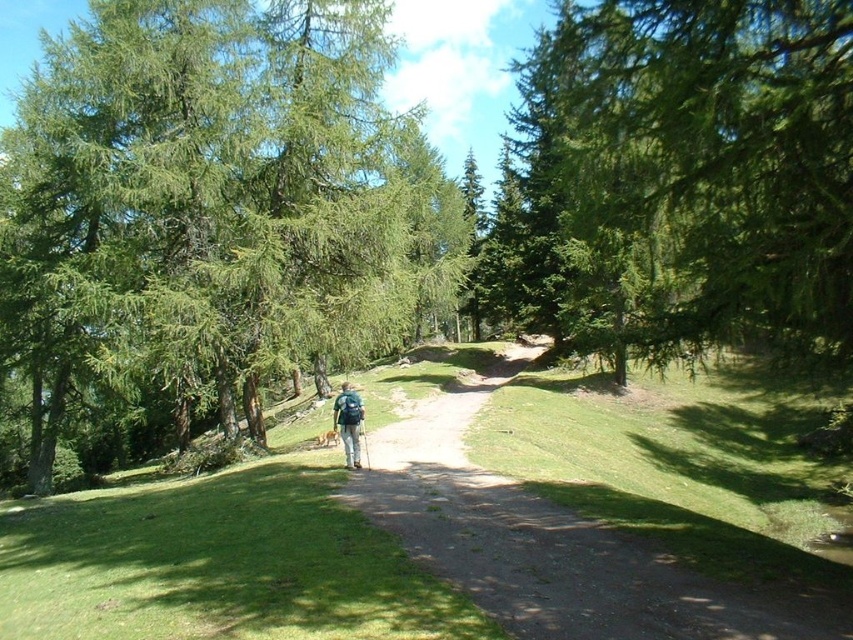
You are a hiker standing at the start of the dirt path at center. You notice a green textured tree at upper center in the distance. If you walk straight ahead along the path, will the tree eventually block your path completely?

The green textured tree at upper center is much taller than the dirt path at center, but height alone doesn not necessarily block the path. The tree might be positioned to the side or behind, so it may not block the path completely. However, without knowing its exact position relative to the path, it is uncertain.

You are standing on the dirt path in the forest scene. You notice two points marked in the image. Which of these points, point 1 at coordinates point (556, 506) or point 2 at coordinates point (354, 442), is closer to your current position?

Point 1 at coordinates point (556, 506) is closer to your current position because it is closer to the camera than point 2 at coordinates point (354, 442).